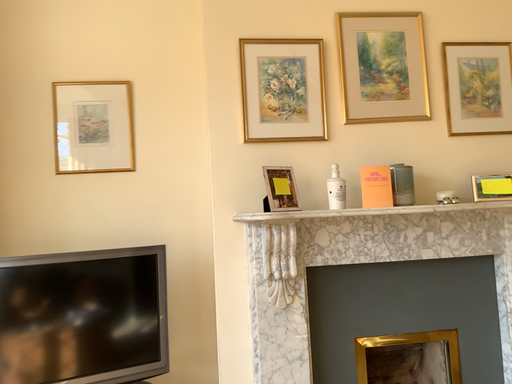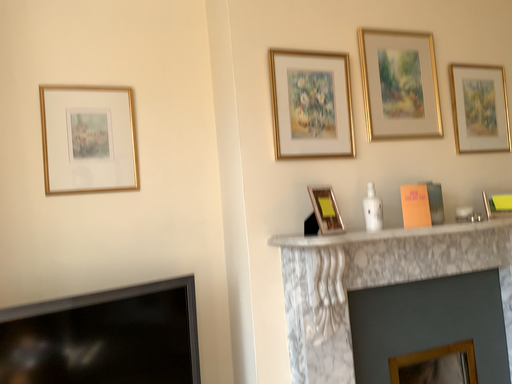
Question: Which way did the camera rotate in the video?

Choices:
 (A) rotated right
 (B) rotated left

Answer: (A)